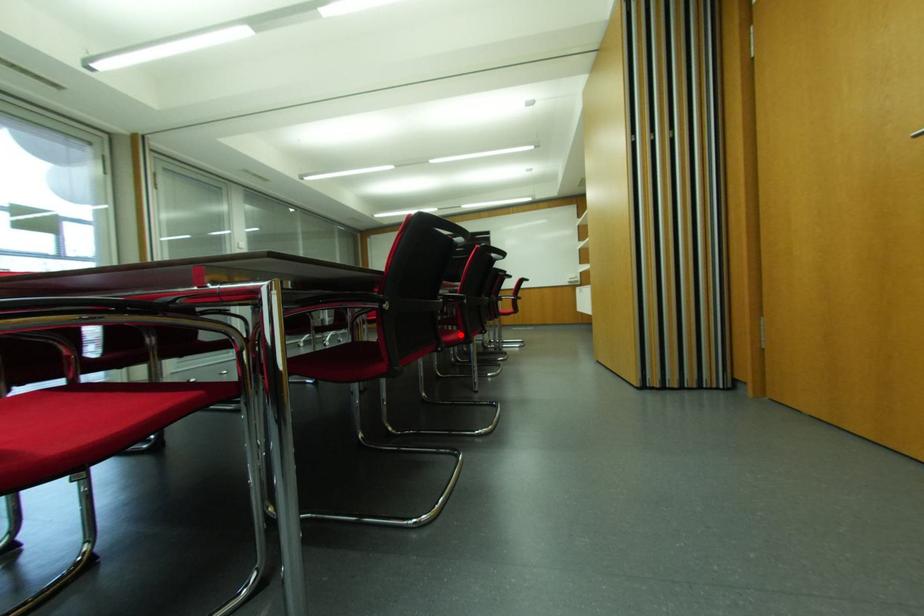
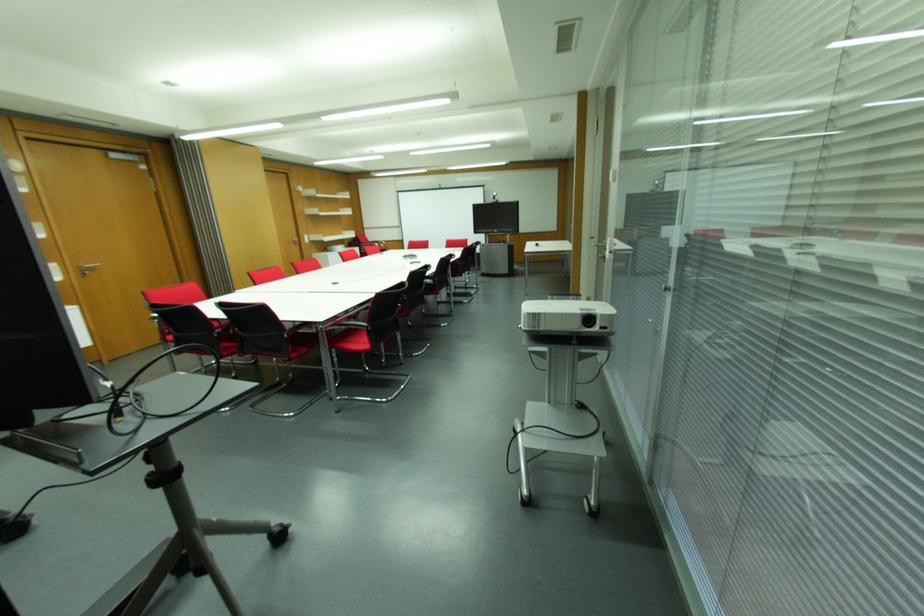
Question: I am providing you with two images of the same scene from different viewpoints. A red point is marked on the first image. Is the red point's position out of view in image 2?

Choices:
 (A) Yes
 (B) No

Answer: (A)